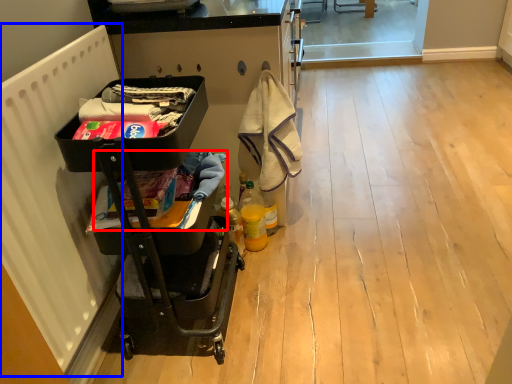
Question: Which of the following is the farthest to the observer, laundry (highlighted by a red box) or radiator (highlighted by a blue box)?

Choices:
 (A) laundry
 (B) radiator

Answer: (A)